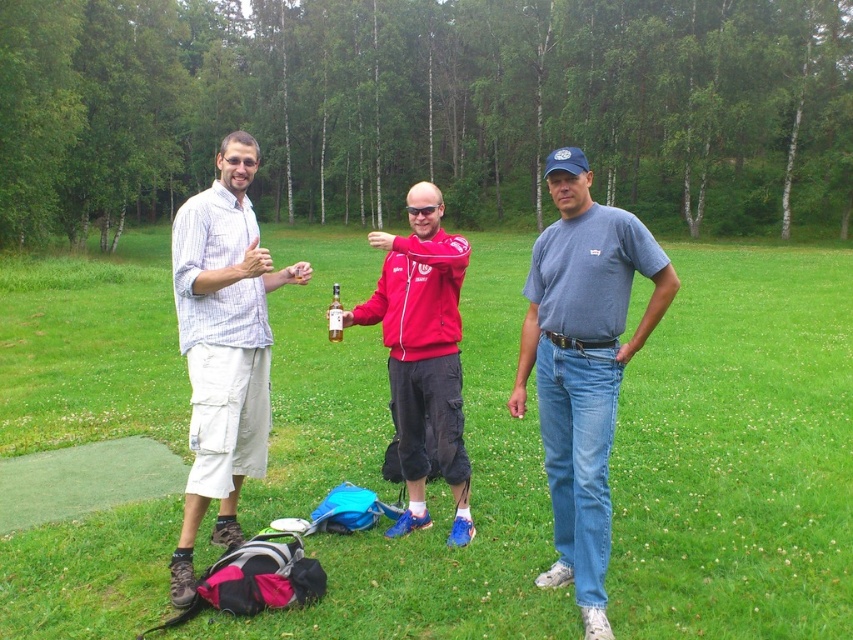
Which is above, denim jeans at center or matte red jacket at center?

matte red jacket at center

Between point (560, 240) and point (461, 497), which one is positioned behind?

Positioned behind is point (461, 497).

At what (x,y) coordinates should I click in order to perform the action: click on denim jeans at center. Please return your answer as a coordinate pair (x, y). This screenshot has height=640, width=853. Looking at the image, I should click on (582, 364).

Who is more distant from viewer, [596,292] or [195,376]?

Positioned behind is point [195,376].

Based on the photo, does denim jeans at center have a lesser width compared to striped cotton shirt at left?

Yes, denim jeans at center is thinner than striped cotton shirt at left.

Is point (578, 244) farther from viewer compared to point (260, 368)?

That is False.

At what (x,y) coordinates should I click in order to perform the action: click on denim jeans at center. Please return your answer as a coordinate pair (x, y). Image resolution: width=853 pixels, height=640 pixels. Looking at the image, I should click on (582, 364).

Can you confirm if green grass at center is positioned above denim jeans at center?

Indeed, green grass at center is positioned over denim jeans at center.

Can you confirm if green grass at center is taller than denim jeans at center?

Yes.

This screenshot has height=640, width=853. What are the coordinates of `green grass at center` in the screenshot? It's located at (738, 452).